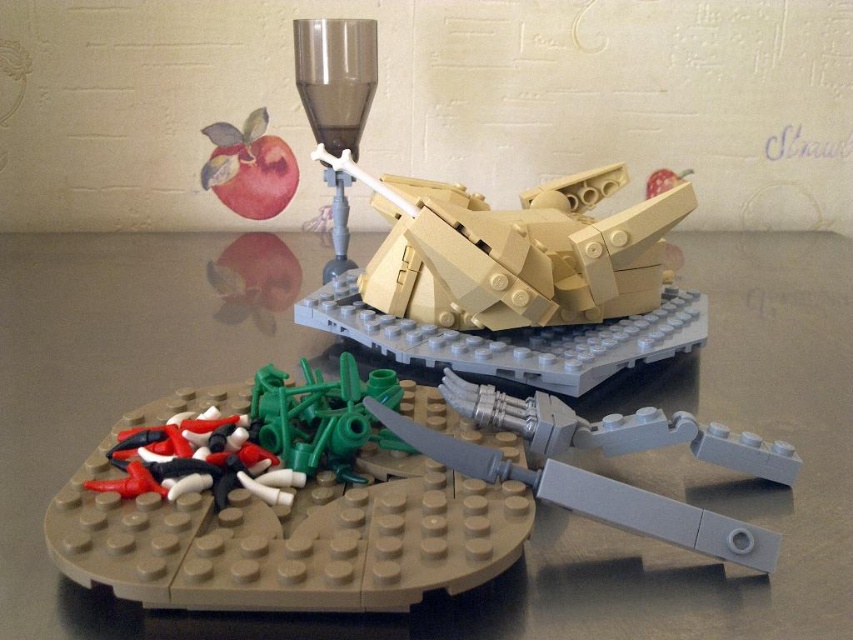
Question: Is brown matte table at center in front of gray plastic knife at center?

Choices:
 (A) yes
 (B) no

Answer: (A)

Question: Which object is the closest to the gray plastic knife at center?

Choices:
 (A) tan matte tank at center
 (B) matte red apple at upper left
 (C) brown matte table at center

Answer: (A)

Question: Which point is farther to the camera?

Choices:
 (A) matte red apple at upper left
 (B) tan matte tank at center
 (C) brown matte table at center

Answer: (A)

Question: Is brown matte table at center positioned behind gray plastic knife at center?

Choices:
 (A) no
 (B) yes

Answer: (A)

Question: Based on their relative distances, which object is nearer to the gray plastic knife at center?

Choices:
 (A) brown matte table at center
 (B) matte red apple at upper left
 (C) tan matte tank at center

Answer: (C)

Question: Is tan matte tank at center in front of matte red apple at upper left?

Choices:
 (A) yes
 (B) no

Answer: (A)